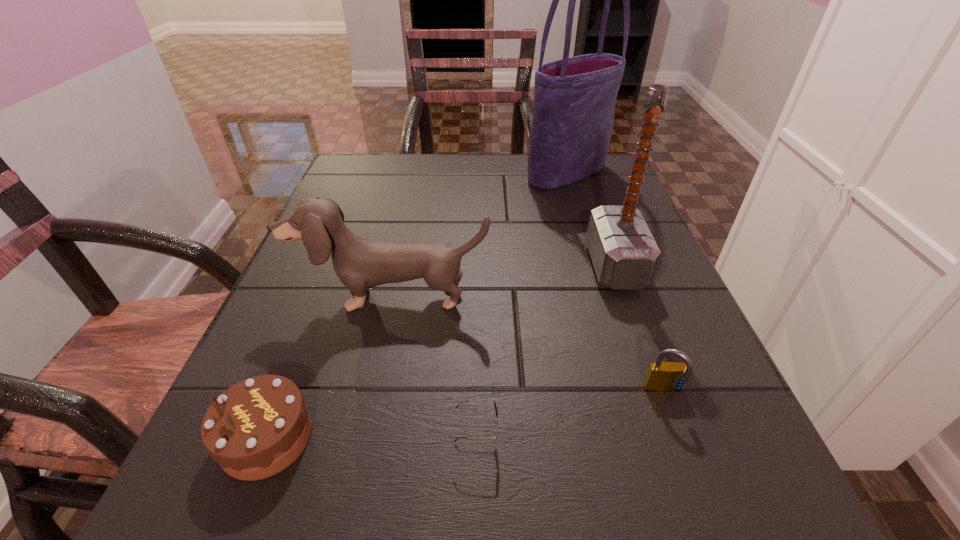
The width and height of the screenshot is (960, 540). Find the location of `tote bag that is at the right edge`. tote bag that is at the right edge is located at coordinates (574, 98).

Locate an element on the screen. hammer positioned at the right edge is located at coordinates (624, 254).

This screenshot has height=540, width=960. In order to click on padlock situated at the right edge in this screenshot , I will do `click(661, 376)`.

Where is `object located at the near left corner`? The image size is (960, 540). object located at the near left corner is located at coordinates (258, 427).

This screenshot has height=540, width=960. I want to click on object located in the far right corner section of the desktop, so click(574, 98).

In the image, there is a desktop. Where is `free space at the far edge`? free space at the far edge is located at coordinates (479, 160).

In the image, there is a desktop. Identify the location of free space at the near edge. The image size is (960, 540). (420, 501).

Locate an element on the screen. The height and width of the screenshot is (540, 960). free region at the left edge of the desktop is located at coordinates (324, 333).

The image size is (960, 540). Identify the location of free spot at the right edge of the desktop. (649, 446).

Where is `free region at the far left corner of the desktop`? Image resolution: width=960 pixels, height=540 pixels. free region at the far left corner of the desktop is located at coordinates (391, 178).